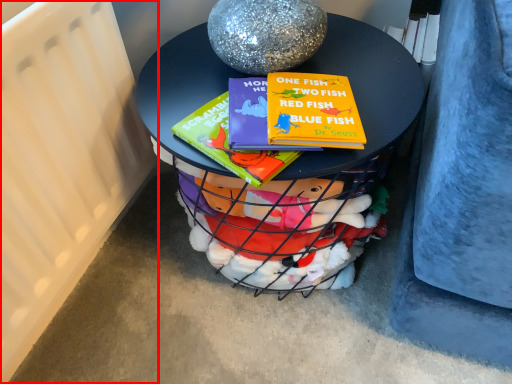
Question: From the image, what is the correct spatial relationship of radiator (annotated by the red box) in relation to table?

Choices:
 (A) left
 (B) right

Answer: (A)